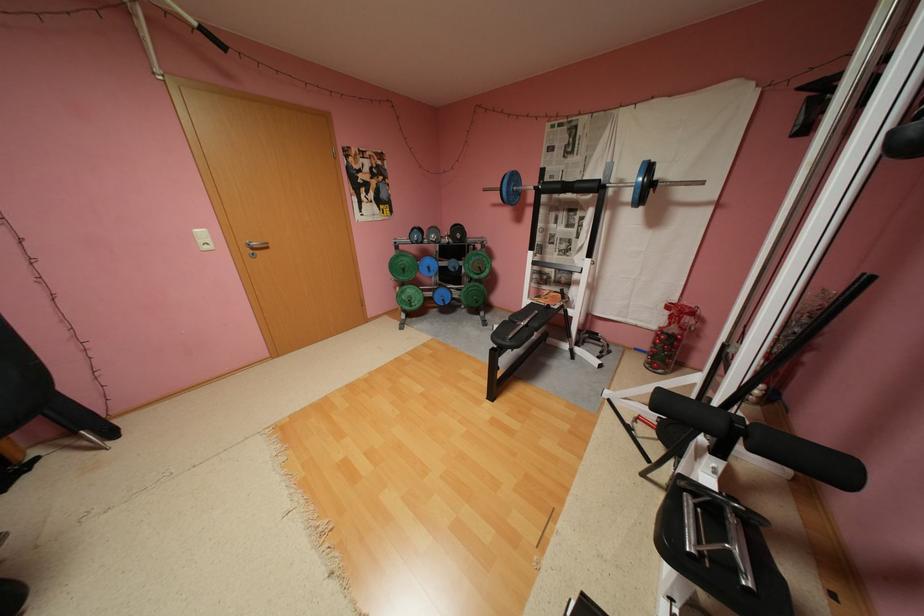
The location [572,187] corresponds to which object?

It refers to a blue barbell weight.